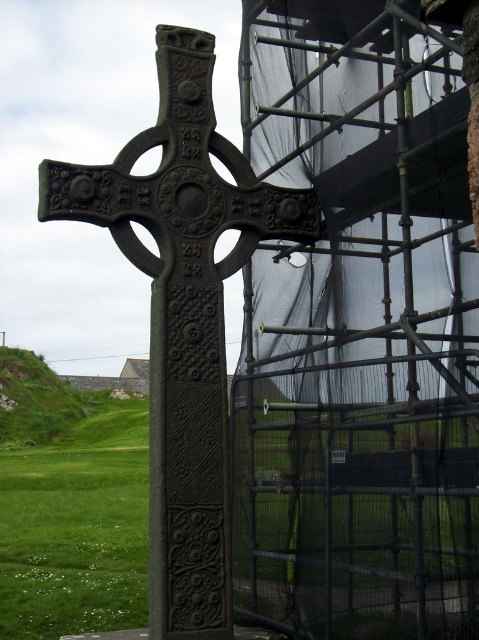
Question: Is metal scaffolding at right above dark gray cast iron cross at center?

Choices:
 (A) yes
 (B) no

Answer: (A)

Question: In this image, where is metal scaffolding at right located relative to dark gray cast iron cross at center?

Choices:
 (A) above
 (B) below

Answer: (A)

Question: Which point appears closest to the camera in this image?

Choices:
 (A) (215, 264)
 (B) (300, 177)

Answer: (A)

Question: Which point appears closest to the camera in this image?

Choices:
 (A) (334, 234)
 (B) (202, 376)

Answer: (B)

Question: Which of the following is the closest to the observer?

Choices:
 (A) metal scaffolding at right
 (B) dark gray cast iron cross at center

Answer: (A)

Question: Does metal scaffolding at right come in front of dark gray cast iron cross at center?

Choices:
 (A) yes
 (B) no

Answer: (A)